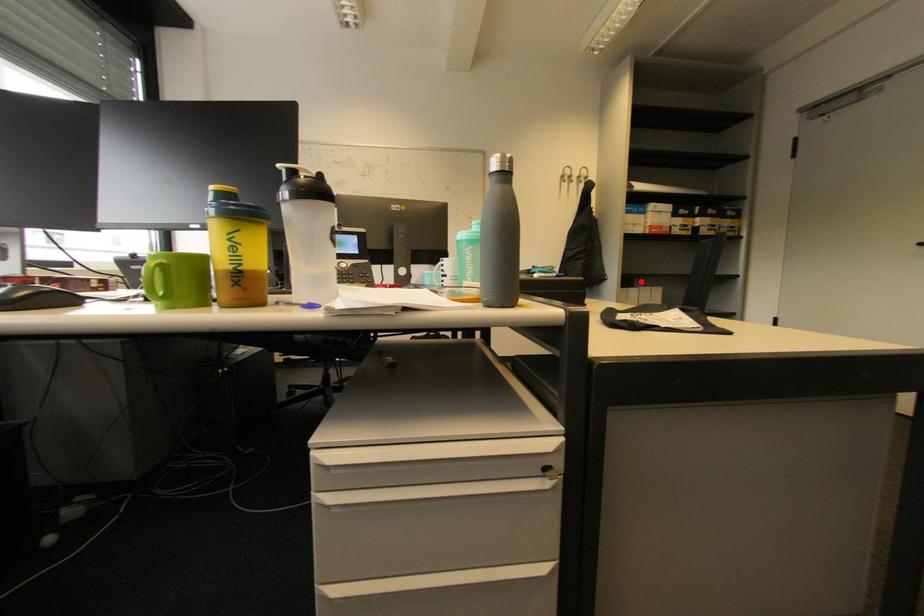
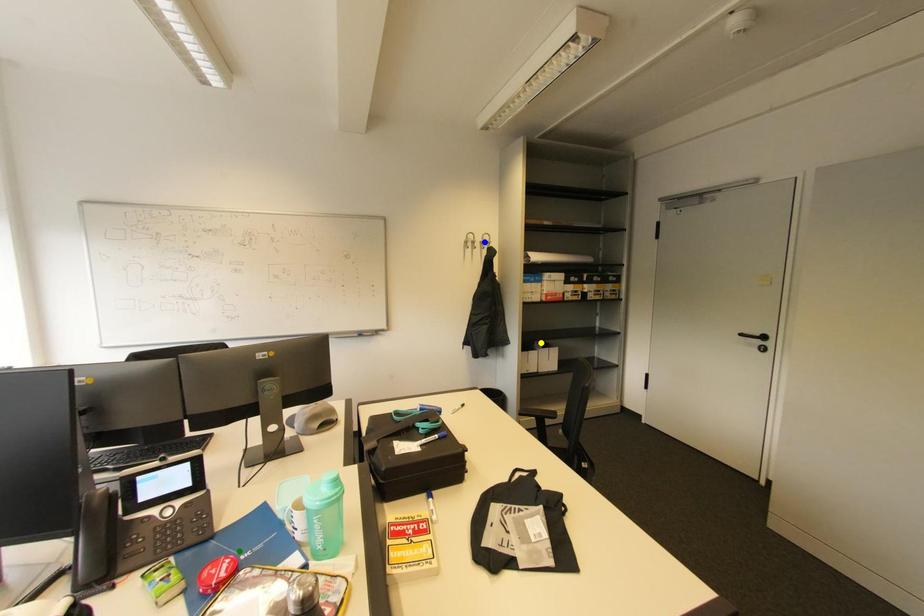
Question: I am providing you with two images of the same scene from different viewpoints. A red point is marked on the first image. You are given multiple points on the second image. Which spot in image 2 lines up with the point in image 1?

Choices:
 (A) blue point
 (B) yellow point
 (C) green point

Answer: (B)